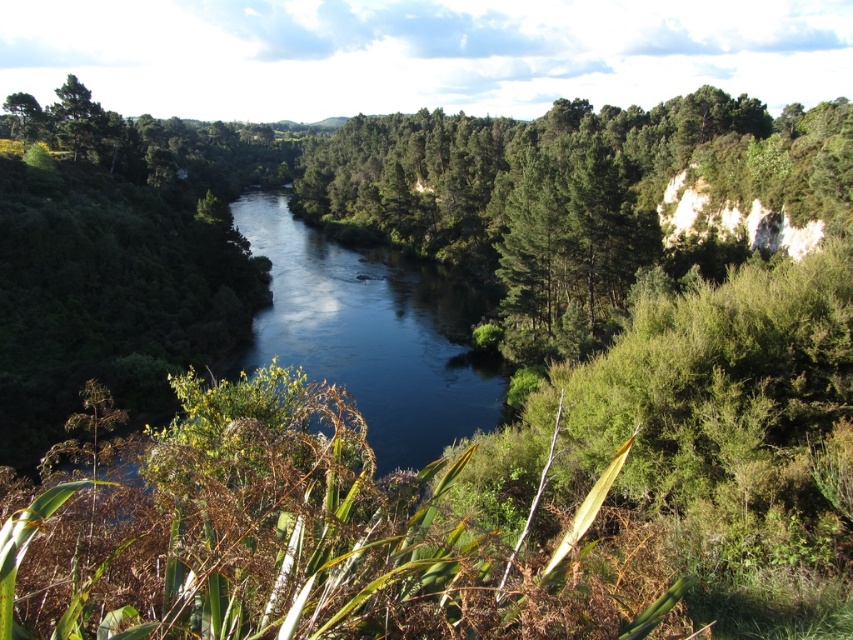
Question: Estimate the real-world distances between objects in this image. Which object is closer to the green leafy tree at upper left?

Choices:
 (A) dark blue water at center
 (B) green leafy tree at center

Answer: (A)

Question: Which point is farther from the camera taking this photo?

Choices:
 (A) (337, 305)
 (B) (798, 246)

Answer: (A)

Question: Among these points, which one is farthest from the camera?

Choices:
 (A) (416, 346)
 (B) (525, 228)

Answer: (A)

Question: Can you confirm if green leafy tree at center is smaller than green leafy tree at upper left?

Choices:
 (A) no
 (B) yes

Answer: (A)

Question: Can you confirm if green leafy tree at center is positioned to the right of dark blue water at center?

Choices:
 (A) yes
 (B) no

Answer: (A)

Question: Can you confirm if dark blue water at center is positioned below green leafy tree at upper left?

Choices:
 (A) yes
 (B) no

Answer: (A)